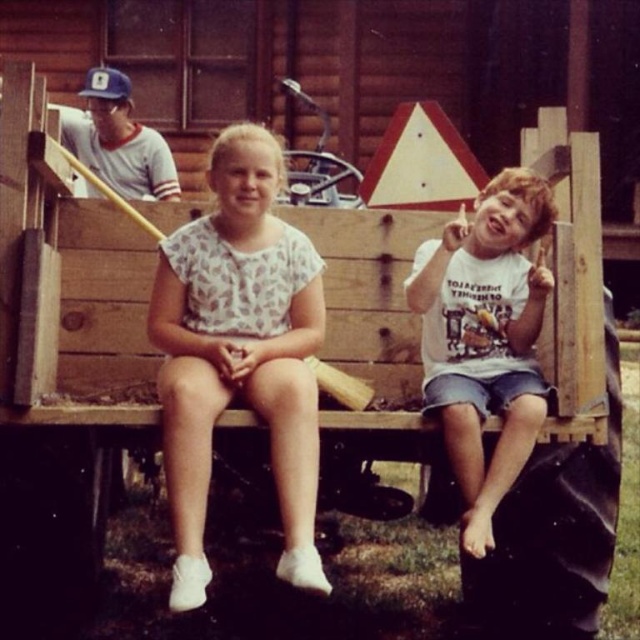
You are a photographer trying to capture both the white floral dress at center and the white cotton shirt at right in a single shot. Based on their positions, which direction should you move your camera to include both subjects?

Since the white floral dress at center is to the left of the white cotton shirt at right, you should move your camera to the left to ensure both subjects are captured in the frame.

Consider the image. You are a photographer setting up a shot of the two children on the wooden bench. You want to ensure both the white floral dress at center and the white cotton shirt at right are clearly visible. Which child should you focus on first to avoid blurring due to their clothing width?

You should focus on the white floral dress at center first because it might be wider than the white cotton shirt at right, so capturing it clearly is essential to avoid blurring.

You are standing at the viewpoint of the image and want to walk towards the point labeled as point (506, 202). Which direction should you move relative to point (264, 404)?

You should move towards the back of point (264, 404) because point (506, 202) is behind it.